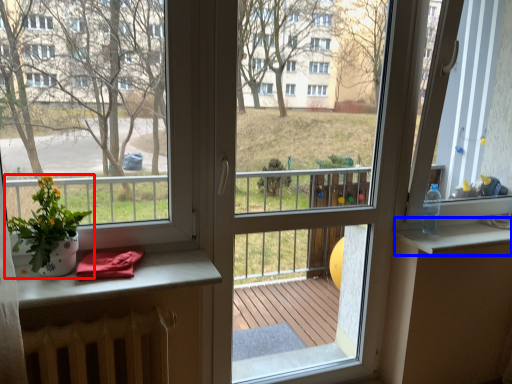
Question: Which point is closer to the camera, houseplant (highlighted by a red box) or window sill (highlighted by a blue box)?

Choices:
 (A) houseplant
 (B) window sill

Answer: (A)